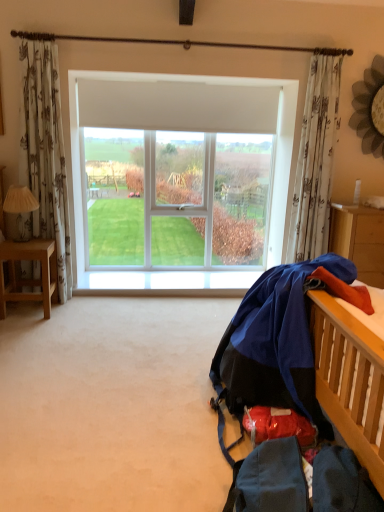
Question: From a real-world perspective, is orange fabric at right above or below white floral fabric curtain at upper right?

Choices:
 (A) above
 (B) below

Answer: (B)

Question: Would you say orange fabric at right is to the left or to the right of white floral fabric curtain at upper right in the picture?

Choices:
 (A) left
 (B) right

Answer: (B)

Question: Which object is positioned farthest from the light brown wooden desk at left?

Choices:
 (A) blue fabric at right
 (B) orange fabric at right
 (C) white plastic window at center
 (D) white fabric lampshade at left
 (E) white floral fabric curtain at upper right

Answer: (B)

Question: Estimate the real-world distances between objects in this image. Which object is closer to the white floral fabric curtain at upper right?

Choices:
 (A) blue fabric at right
 (B) light brown wooden desk at left
 (C) white fabric lampshade at left
 (D) orange fabric at right
 (E) white plastic window at center

Answer: (D)